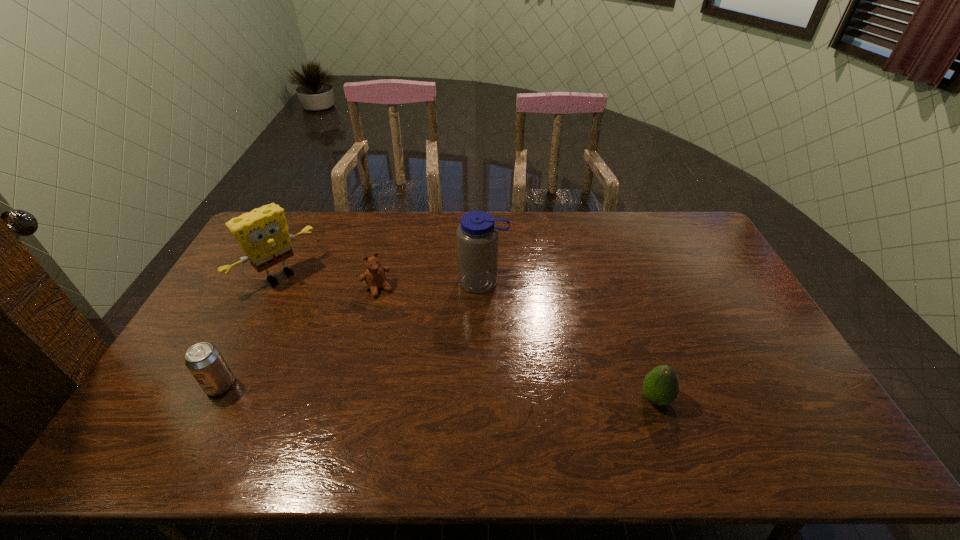
Image resolution: width=960 pixels, height=540 pixels. Find the location of `vacant space on the desktop that is between the beer can and the rightmost object and is positioned with a carrying loop on the side of the second object from right to left`. vacant space on the desktop that is between the beer can and the rightmost object and is positioned with a carrying loop on the side of the second object from right to left is located at coordinates (451, 393).

Image resolution: width=960 pixels, height=540 pixels. What are the coordinates of `free space on the desktop that is between the beer can and the avocado and is positioned on the face of the teddy bear` in the screenshot? It's located at (444, 392).

I want to click on vacant space on the desktop that is between the beer can and the rightmost object and is positioned on the face of the sponge, so click(403, 391).